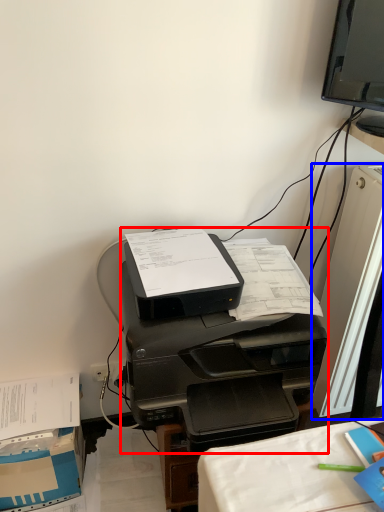
Question: Which object is closer to the camera taking this photo, printer (highlighted by a red box) or desktop computer (highlighted by a blue box)?

Choices:
 (A) printer
 (B) desktop computer

Answer: (A)